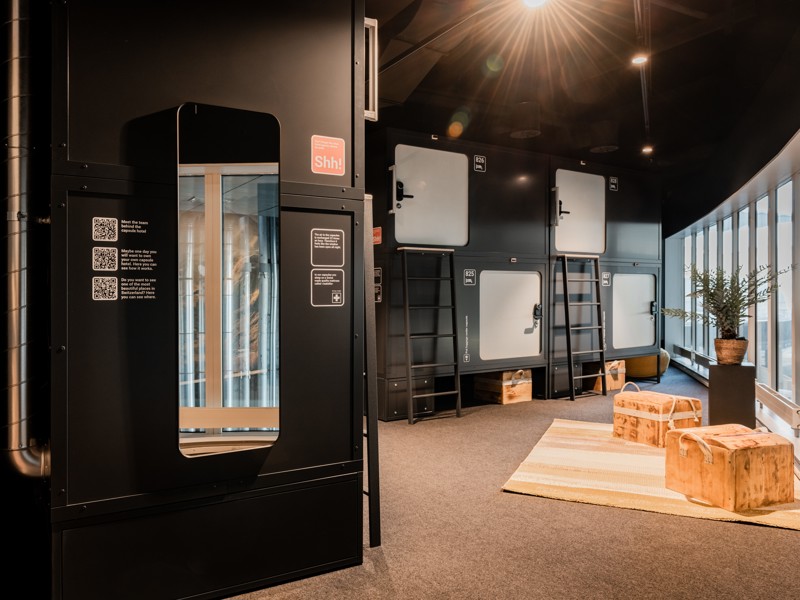
The image size is (800, 600). What are the coordinates of `wooden box` in the screenshot? It's located at (741, 462), (649, 420), (518, 390), (618, 376).